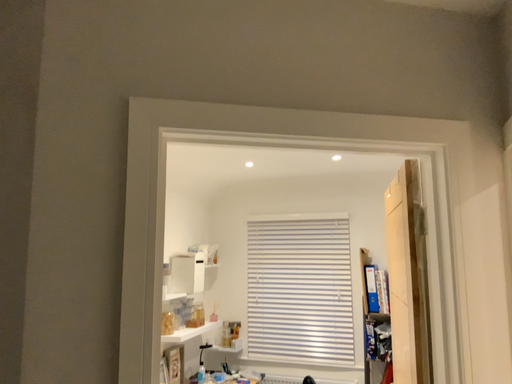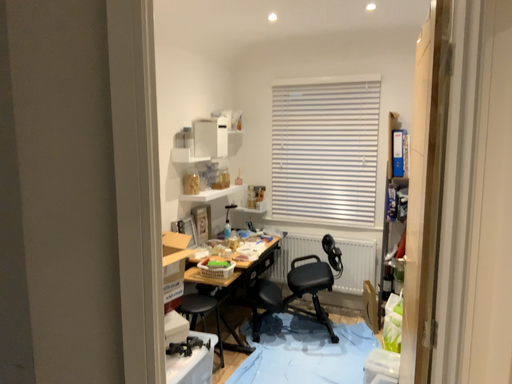
Question: How did the camera likely rotate when shooting the video?

Choices:
 (A) rotated upward
 (B) rotated downward

Answer: (B)